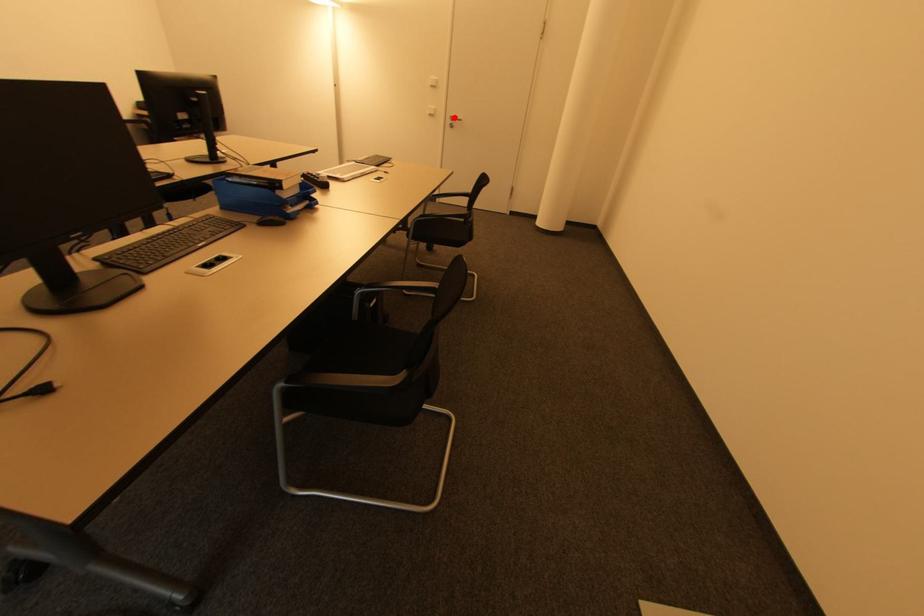
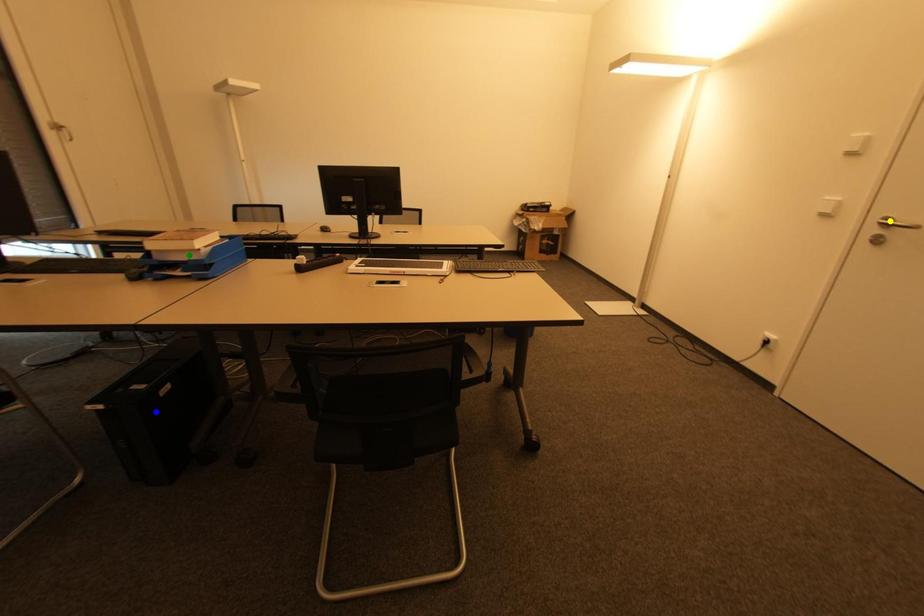
Question: I am providing you with two images of the same scene from different viewpoints. A red point is marked on the first image. You are given multiple points on the second image. Which point in image 2 represents the same 3d spot as the red point in image 1?

Choices:
 (A) blue point
 (B) green point
 (C) yellow point

Answer: (C)